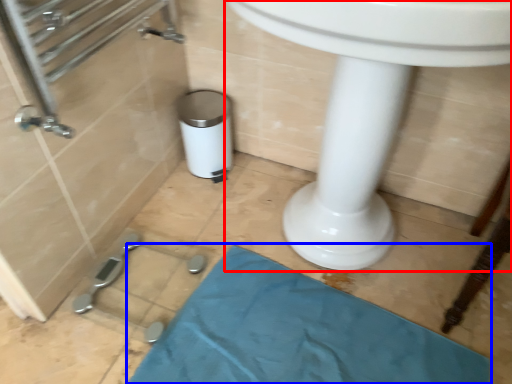
Question: Which of the following is the farthest to the observer, sink (highlighted by a red box) or bath mat (highlighted by a blue box)?

Choices:
 (A) sink
 (B) bath mat

Answer: (B)